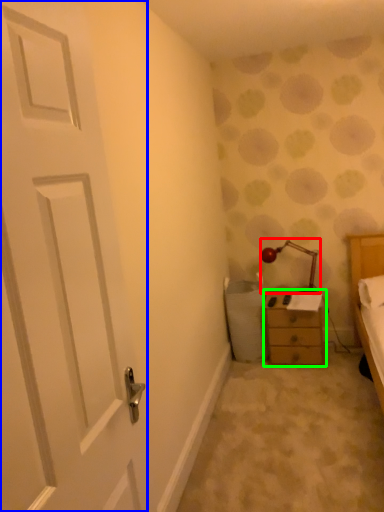
Question: Which object is the farthest from lamp (highlighted by a red box)? Choose among these: door (highlighted by a blue box) or chest of drawers (highlighted by a green box).

Choices:
 (A) door
 (B) chest of drawers

Answer: (A)